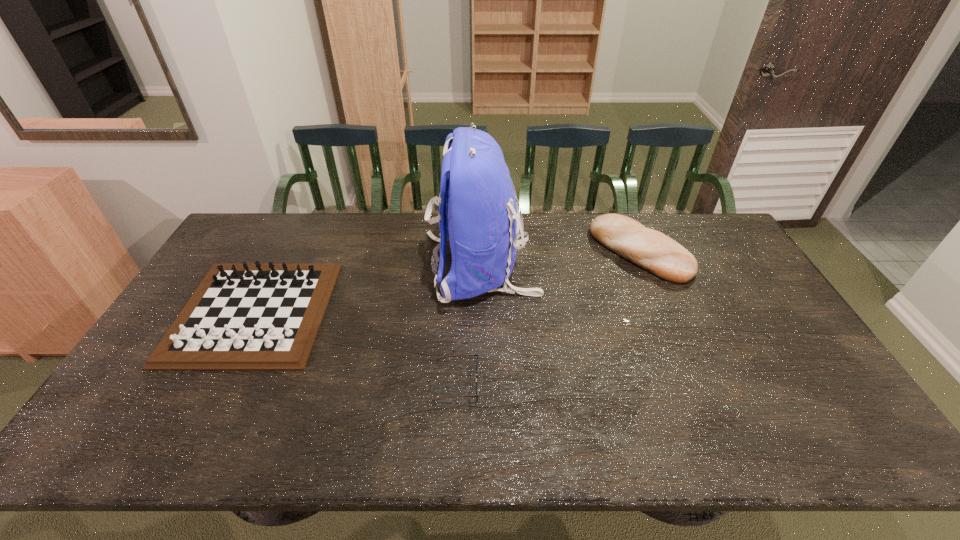
I want to click on the tallest object, so click(477, 205).

I want to click on the rightmost object, so coord(650,249).

The height and width of the screenshot is (540, 960). Identify the location of gameboard. (242, 317).

Image resolution: width=960 pixels, height=540 pixels. Identify the location of spectacles. (477, 380).

I want to click on vacant region located 0.320m on the back of the backpack, so click(x=325, y=267).

The width and height of the screenshot is (960, 540). I want to click on free space located on the back of the backpack, so click(x=310, y=267).

I want to click on free space located on the back of the backpack, so click(x=303, y=267).

Find the location of a particular element. This screenshot has width=960, height=540. vacant point located on the left of the bread is located at coordinates (528, 252).

Locate an element on the screen. vacant space located on the right of the gameboard is located at coordinates (376, 312).

Where is `vacant space located 0.330m on the front-facing side of the spectacles`? The width and height of the screenshot is (960, 540). vacant space located 0.330m on the front-facing side of the spectacles is located at coordinates (608, 381).